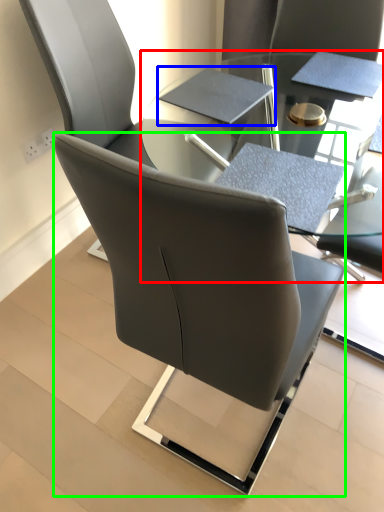
Question: Based on their relative distances, which object is nearer to table (highlighted by a red box)? Choose from notebook (highlighted by a blue box) and chair (highlighted by a green box).

Choices:
 (A) notebook
 (B) chair

Answer: (A)